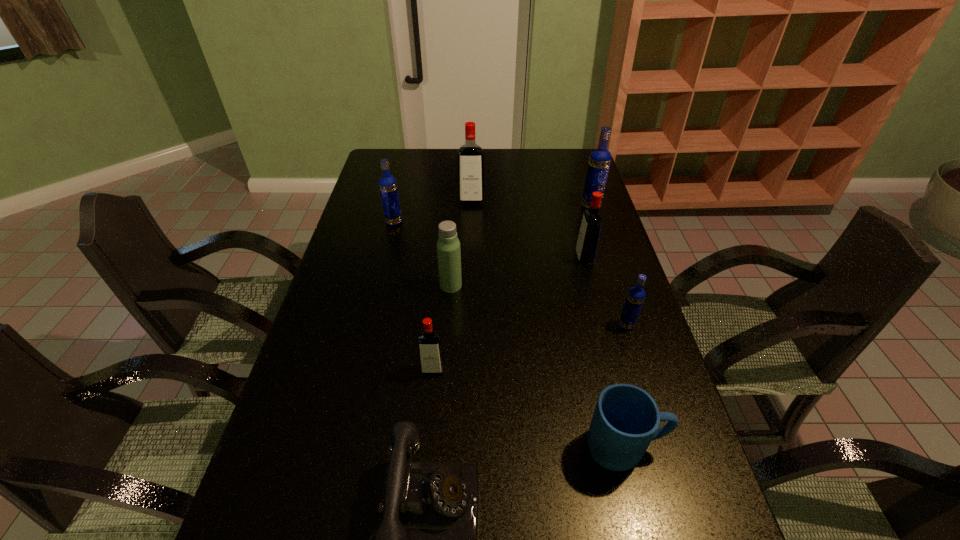
Find the location of `vacant space that is in between the nearest blue vodka and the second nearest blue vodka`. vacant space that is in between the nearest blue vodka and the second nearest blue vodka is located at coordinates (510, 274).

This screenshot has width=960, height=540. I want to click on free space that is in between the fourth nearest vodka and the biggest blue vodka, so click(x=492, y=214).

Locate an element on the screen. The image size is (960, 540). vacant point located between the smallest blue vodka and the thermos bottle is located at coordinates (539, 305).

Identify the location of vacant area that lies between the leftmost red vodka and the third nearest vodka. The height and width of the screenshot is (540, 960). (509, 314).

Find the location of `free spot between the farthest red vodka and the biggest blue vodka`. free spot between the farthest red vodka and the biggest blue vodka is located at coordinates (531, 204).

Identify which object is located as the eighth nearest to the thermos bottle. Please provide its 2D coordinates. Your answer should be formatted as a tuple, i.e. [(x, y)], where the tuple contains the x and y coordinates of a point satisfying the conditions above.

[(600, 158)]

Identify which object is the third nearest to the nearest red vodka. Please provide its 2D coordinates. Your answer should be formatted as a tuple, i.e. [(x, y)], where the tuple contains the x and y coordinates of a point satisfying the conditions above.

[(626, 418)]

This screenshot has width=960, height=540. What are the coordinates of `vodka that is the third closest to the sixth farthest object` in the screenshot? It's located at (600, 158).

Locate which vodka is the third closest to the second red vodka from left to right. Please provide its 2D coordinates. Your answer should be formatted as a tuple, i.e. [(x, y)], where the tuple contains the x and y coordinates of a point satisfying the conditions above.

[(587, 243)]

Locate an element on the screen. blue vodka that stands as the second closest to the smallest blue vodka is located at coordinates (388, 186).